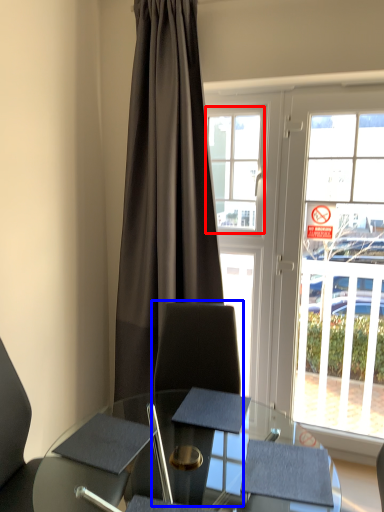
Question: Which of the following is the closest to the observer, bay window (highlighted by a red box) or swivel chair (highlighted by a blue box)?

Choices:
 (A) bay window
 (B) swivel chair

Answer: (B)